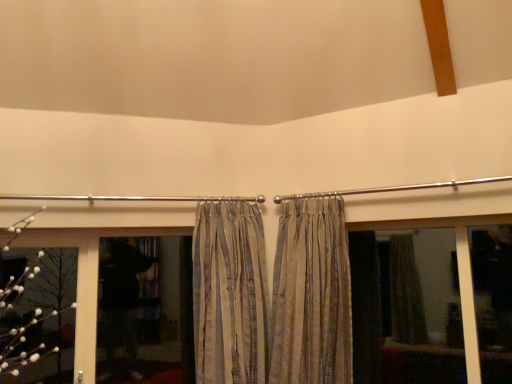
Question: In terms of height, does black matte screen door at center look taller or shorter compared to striped fabric curtain at center, placed as the first curtain when sorted from left to right?

Choices:
 (A) short
 (B) tall

Answer: (A)

Question: Based on their sizes in the image, would you say black matte screen door at center is bigger or smaller than striped fabric curtain at center, placed as the second curtain when sorted from right to left?

Choices:
 (A) big
 (B) small

Answer: (B)

Question: Based on their relative distances, which object is nearer to the white fluffy flower at left?

Choices:
 (A) silky beige curtains at center, which is the second curtain from left to right
 (B) dark glass window at lower left
 (C) striped fabric curtain at center, placed as the second curtain when sorted from right to left
 (D) matte glass window at center
 (E) black matte screen door at center

Answer: (B)

Question: Estimate the real-world distances between objects in this image. Which object is closer to the striped fabric curtain at center, placed as the first curtain when sorted from left to right?

Choices:
 (A) dark glass window at lower left
 (B) matte glass window at center
 (C) black matte screen door at center
 (D) silky beige curtains at center, the first curtain in the right-to-left sequence
 (E) white fluffy flower at left

Answer: (D)